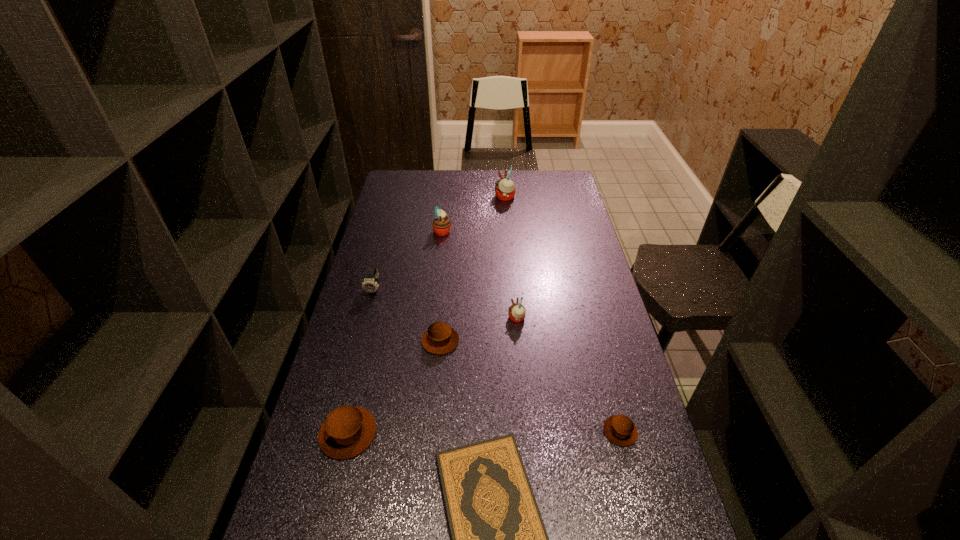
Identify the location of vacant area at the left edge. This screenshot has height=540, width=960. (336, 511).

This screenshot has width=960, height=540. Identify the location of vacant region at the right edge. (596, 327).

You are a GUI agent. You are given a task and a screenshot of the screen. Output one action in this format:
    pyautogui.click(x=<x>, y=<y>)
    Task: Click on the free spot at the far left corner of the desktop
    The width and height of the screenshot is (960, 540).
    Given the screenshot: What is the action you would take?
    pyautogui.click(x=415, y=172)

Locate an element on the screen. This screenshot has width=960, height=540. free space at the far right corner of the desktop is located at coordinates (556, 171).

This screenshot has height=540, width=960. I want to click on vacant area between the nearest pink muffin and the fifth shortest muffin, so click(480, 274).

The height and width of the screenshot is (540, 960). I want to click on free spot between the farthest muffin and the second nearest pink muffin, so click(x=473, y=214).

Locate an element on the screen. vacant space in between the fifth nearest object and the biggest brown muffin is located at coordinates (432, 376).

The width and height of the screenshot is (960, 540). I want to click on vacant area that lies between the third farthest object and the leftmost brown muffin, so (361, 362).

Where is `free space between the tallest object and the second brown muffin from right to left`? This screenshot has width=960, height=540. free space between the tallest object and the second brown muffin from right to left is located at coordinates click(472, 269).

Identify the location of vacant space in between the third shortest object and the biggest brown muffin. (395, 387).